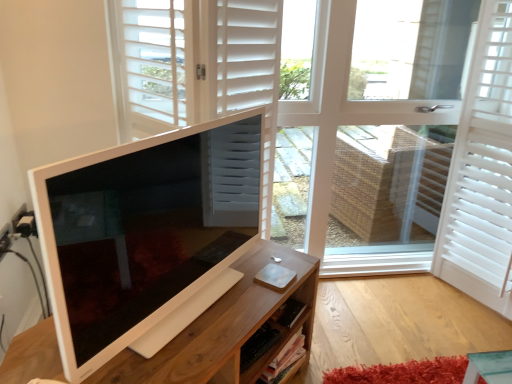
Image resolution: width=512 pixels, height=384 pixels. In order to click on free location to the right of white glossy computer monitor at left in this screenshot , I will do `click(245, 296)`.